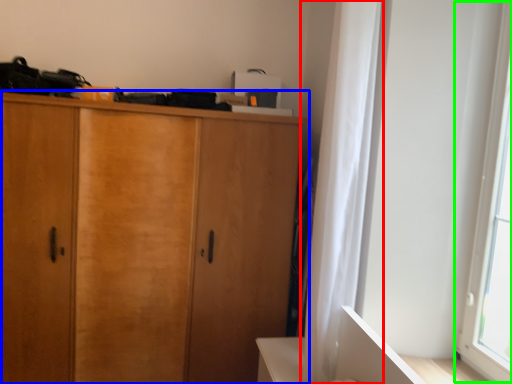
Question: Which is farther away from curtain (highlighted by a red box)? cupboard (highlighted by a blue box) or window screen (highlighted by a green box)?

Choices:
 (A) cupboard
 (B) window screen

Answer: (A)